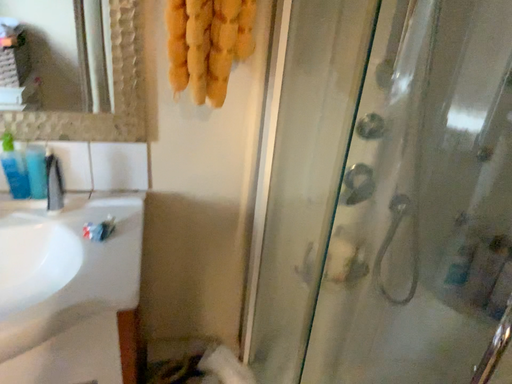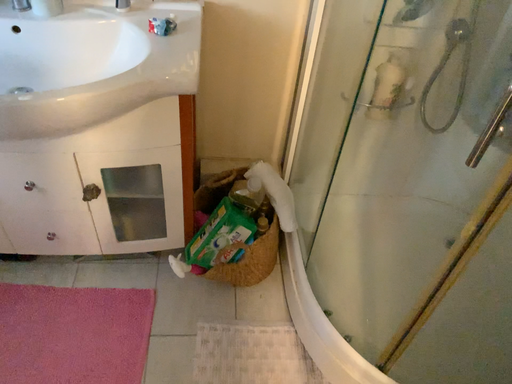
Question: Which way did the camera rotate in the video?

Choices:
 (A) rotated right
 (B) rotated left

Answer: (B)